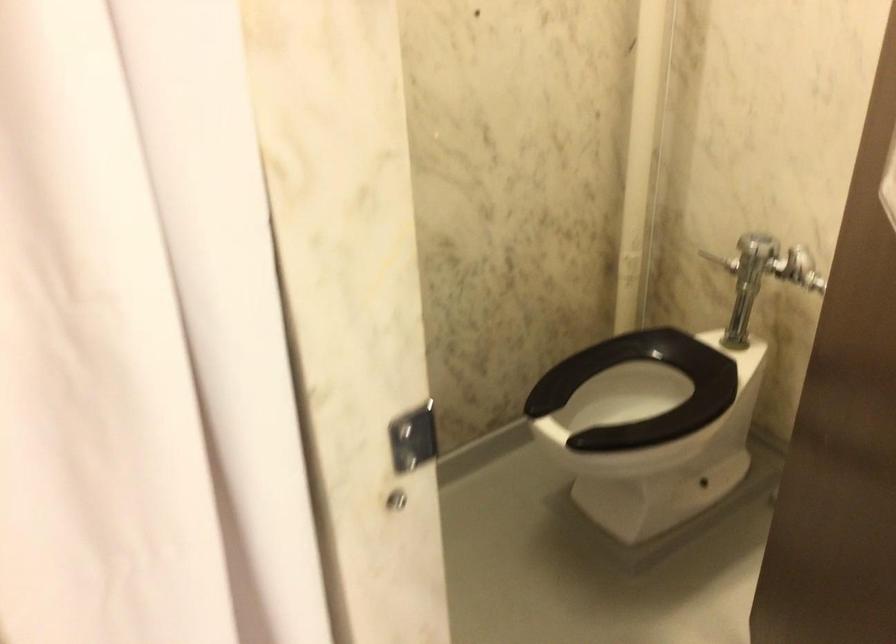
First-person continuous shooting, in which direction is the camera rotating?

The rotation direction of the camera is right-down.